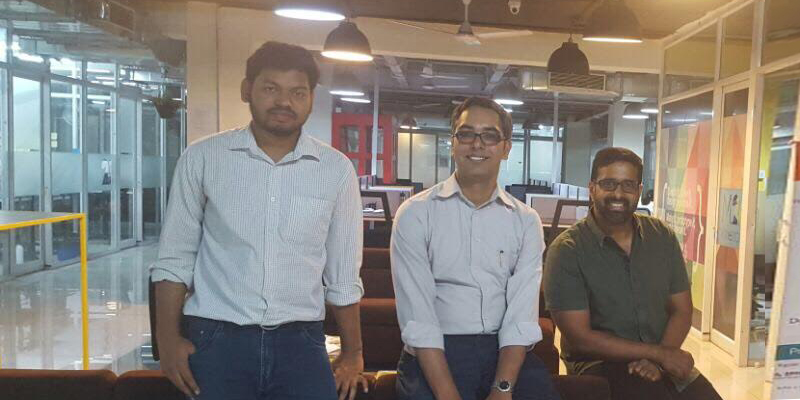
Where is `brown walls`? The height and width of the screenshot is (400, 800). brown walls is located at coordinates (234, 34), (637, 55).